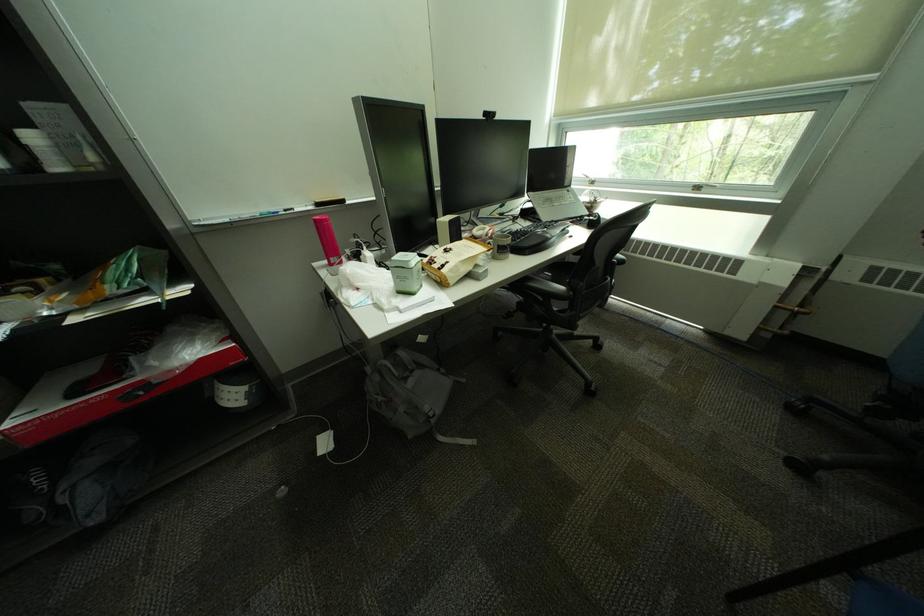
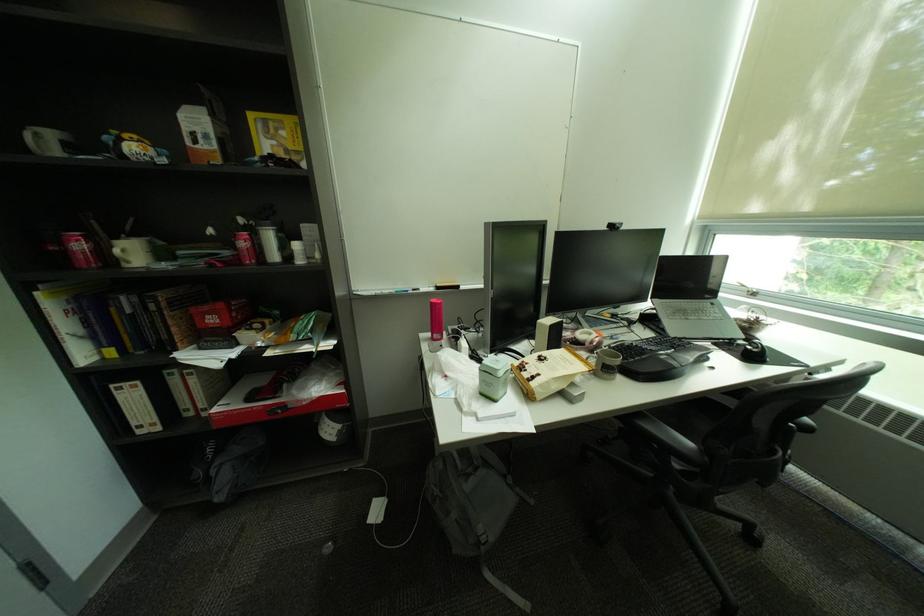
In the second image, find the point that corresponds to (x=409, y=294) in the first image.

(492, 395)